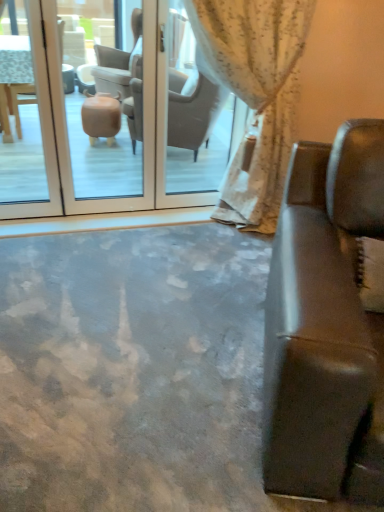
Question: From a real-world perspective, is white floral fabric curtain at upper center on top of transparent glass door at center?

Choices:
 (A) yes
 (B) no

Answer: (A)

Question: Does white floral fabric curtain at upper center have a greater width compared to transparent glass door at center?

Choices:
 (A) yes
 (B) no

Answer: (A)

Question: Does white floral fabric curtain at upper center turn towards transparent glass door at center?

Choices:
 (A) no
 (B) yes

Answer: (A)

Question: Is white floral fabric curtain at upper center at the left side of transparent glass door at center?

Choices:
 (A) no
 (B) yes

Answer: (A)

Question: Could transparent glass door at center be considered to be inside white floral fabric curtain at upper center?

Choices:
 (A) no
 (B) yes

Answer: (A)

Question: In terms of height, does white floral fabric curtain at upper center look taller or shorter compared to transparent glass door at center?

Choices:
 (A) tall
 (B) short

Answer: (A)

Question: Relative to transparent glass door at center, is white floral fabric curtain at upper center in front or behind?

Choices:
 (A) behind
 (B) front

Answer: (B)

Question: From a real-world perspective, is white floral fabric curtain at upper center above or below transparent glass door at center?

Choices:
 (A) below
 (B) above

Answer: (B)

Question: Considering the positions of white floral fabric curtain at upper center and transparent glass door at center in the image, is white floral fabric curtain at upper center bigger or smaller than transparent glass door at center?

Choices:
 (A) big
 (B) small

Answer: (A)

Question: Choose the correct answer: Is leather couch at right inside white floral fabric curtain at upper center or outside it?

Choices:
 (A) inside
 (B) outside

Answer: (B)

Question: Visually, is leather couch at right positioned to the left or to the right of white floral fabric curtain at upper center?

Choices:
 (A) left
 (B) right

Answer: (B)

Question: Considering the positions of leather couch at right and white floral fabric curtain at upper center in the image, is leather couch at right taller or shorter than white floral fabric curtain at upper center?

Choices:
 (A) short
 (B) tall

Answer: (A)

Question: Based on their sizes in the image, would you say leather couch at right is bigger or smaller than white floral fabric curtain at upper center?

Choices:
 (A) big
 (B) small

Answer: (A)

Question: From a real-world perspective, is transparent glass door at center above or below leather couch at right?

Choices:
 (A) above
 (B) below

Answer: (A)

Question: Is transparent glass door at center to the left or to the right of leather couch at right in the image?

Choices:
 (A) left
 (B) right

Answer: (A)